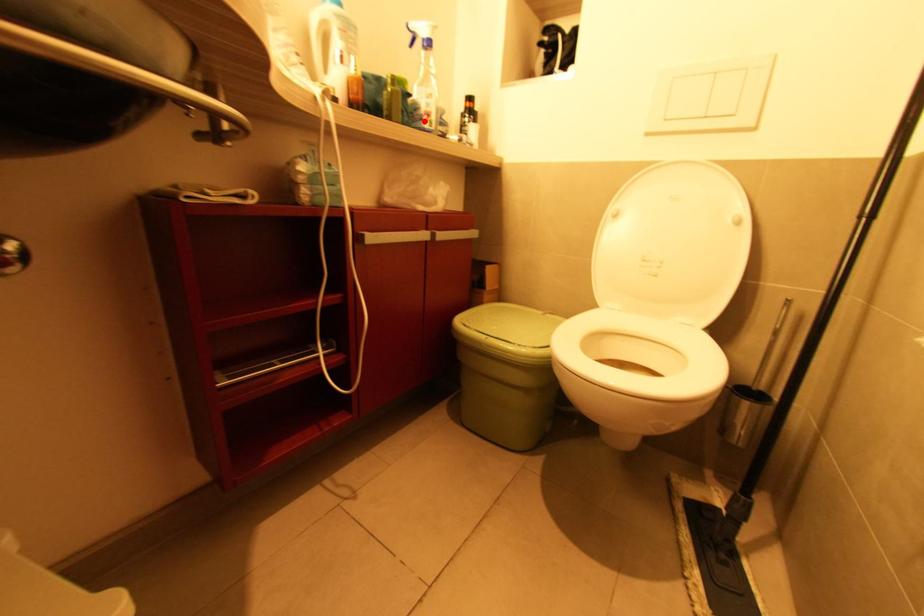
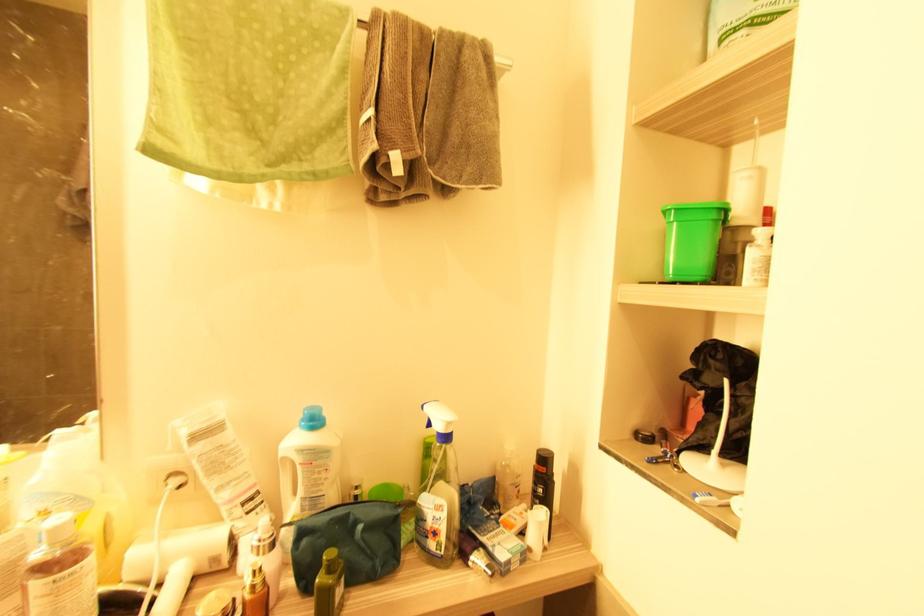
The point at the highlighted location is marked in the first image. Where is the corresponding point in the second image?

(429, 539)